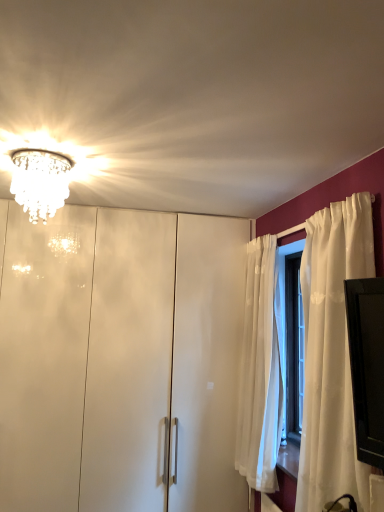
Question: From a real-world perspective, is glossy white dresser at center located beneath crystal glass chandelier at upper left?

Choices:
 (A) no
 (B) yes

Answer: (B)

Question: Is glossy white dresser at center bigger than crystal glass chandelier at upper left?

Choices:
 (A) yes
 (B) no

Answer: (A)

Question: Is glossy white dresser at center further to camera compared to crystal glass chandelier at upper left?

Choices:
 (A) yes
 (B) no

Answer: (A)

Question: From a real-world perspective, is glossy white dresser at center positioned over crystal glass chandelier at upper left based on gravity?

Choices:
 (A) no
 (B) yes

Answer: (A)

Question: From the image's perspective, does glossy white dresser at center appear lower than crystal glass chandelier at upper left?

Choices:
 (A) yes
 (B) no

Answer: (A)

Question: Can you confirm if glossy white dresser at center is positioned to the left of crystal glass chandelier at upper left?

Choices:
 (A) yes
 (B) no

Answer: (B)

Question: Is crystal glass chandelier at upper left shorter than glossy white dresser at center?

Choices:
 (A) no
 (B) yes

Answer: (B)

Question: Is glossy white dresser at center a part of crystal glass chandelier at upper left?

Choices:
 (A) no
 (B) yes

Answer: (A)

Question: Does crystal glass chandelier at upper left appear on the right side of glossy white dresser at center?

Choices:
 (A) no
 (B) yes

Answer: (A)

Question: Can you confirm if crystal glass chandelier at upper left is bigger than glossy white dresser at center?

Choices:
 (A) no
 (B) yes

Answer: (A)

Question: Is crystal glass chandelier at upper left taller than glossy white dresser at center?

Choices:
 (A) yes
 (B) no

Answer: (B)

Question: Are crystal glass chandelier at upper left and glossy white dresser at center located far from each other?

Choices:
 (A) no
 (B) yes

Answer: (B)

Question: From a real-world perspective, is crystal glass chandelier at upper left above or below glossy white dresser at center?

Choices:
 (A) above
 (B) below

Answer: (A)